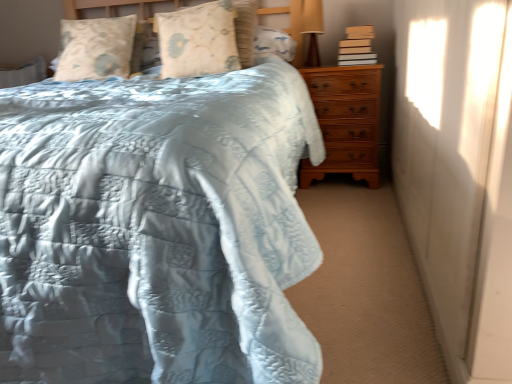
At what (x,y) coordinates should I click in order to perform the action: click on space that is in front of matte brown table lamp at upper right. Please return your answer as a coordinate pair (x, y). Looking at the image, I should click on click(315, 66).